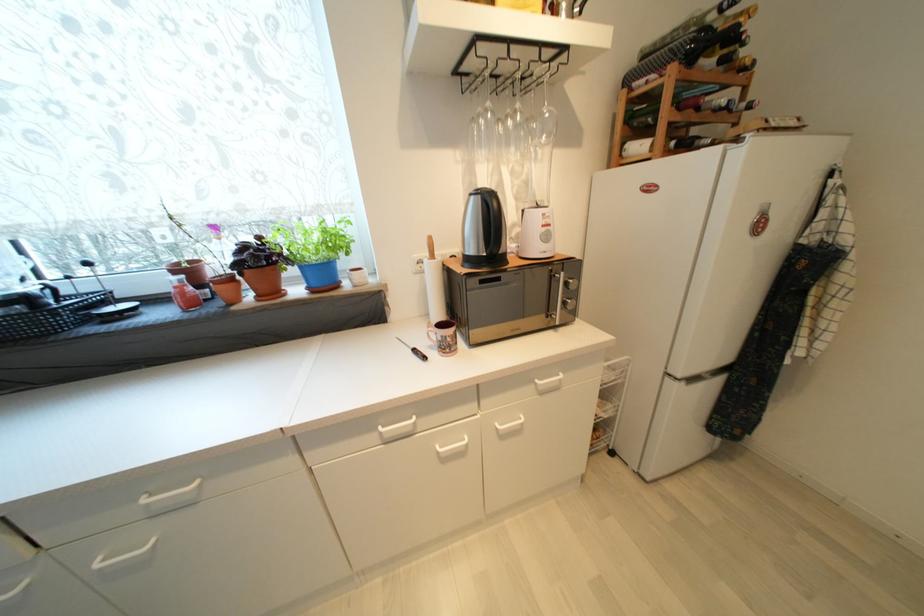
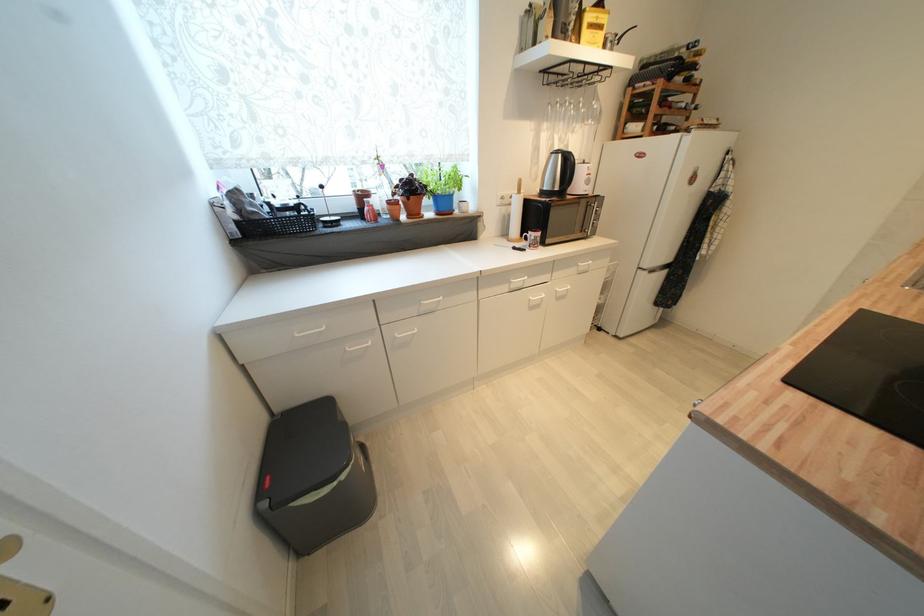
Where in the second image is the point corresponding to point 545,390 from the first image?

(585, 270)